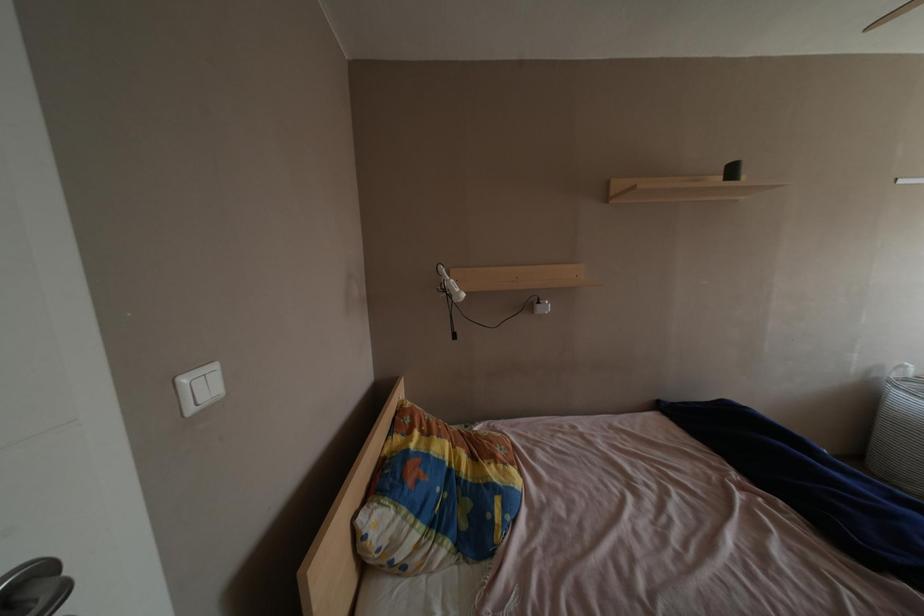
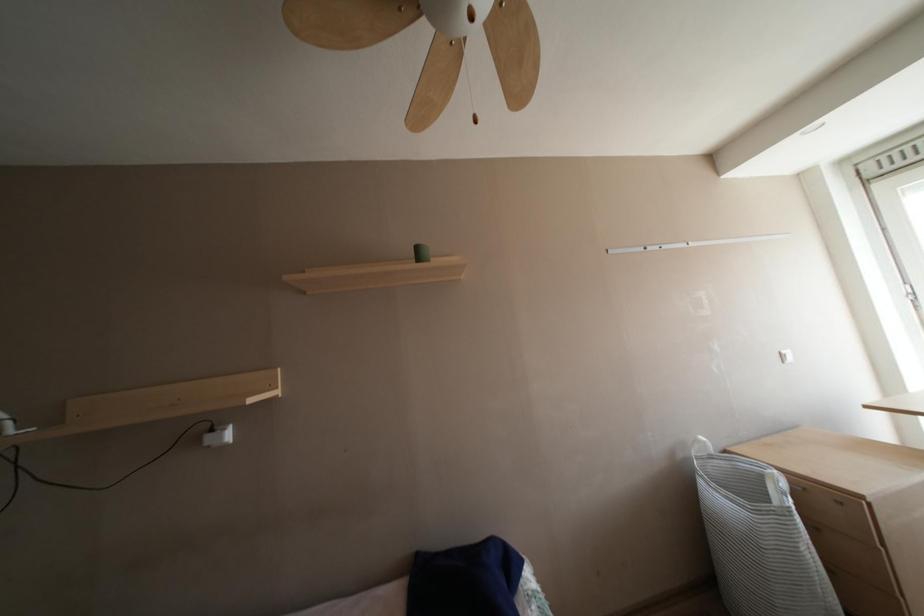
Question: In a continuous first-person perspective shot, in which direction is the camera moving?

Choices:
 (A) Left
 (B) Right
 (C) Forward
 (D) Backward

Answer: (B)